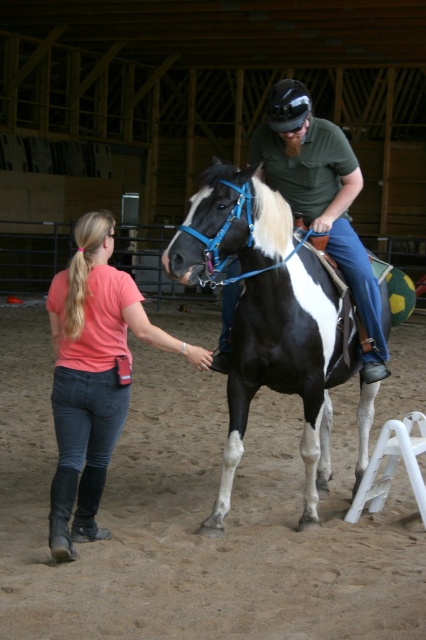
Question: Which point is closer to the camera?

Choices:
 (A) brown sand at lower center
 (B) matte green shirt at center

Answer: (B)

Question: Does black and white speckled horse at center come behind matte green shirt at center?

Choices:
 (A) yes
 (B) no

Answer: (B)

Question: Is brown sand at lower center thinner than denim jeans at lower left?

Choices:
 (A) no
 (B) yes

Answer: (B)

Question: Does brown sand at lower center have a smaller size compared to black and white speckled horse at center?

Choices:
 (A) no
 (B) yes

Answer: (B)

Question: Which object is positioned closest to the black and white speckled horse at center?

Choices:
 (A) brown sand at lower center
 (B) denim jeans at lower left
 (C) matte green shirt at center

Answer: (C)

Question: Among these points, which one is farthest from the camera?

Choices:
 (A) [206, 268]
 (B) [43, 451]
 (C) [344, 134]
 (D) [77, 384]

Answer: (B)